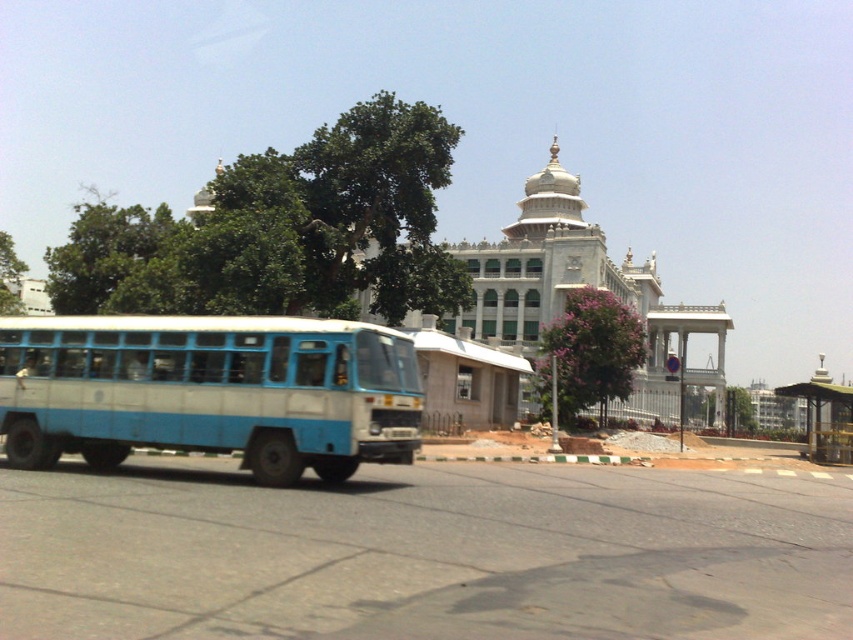
You are a delivery driver who needs to park your vehicle at the designated spot near the ornate building. The blue matte bus at left is currently blocking the path. Can you safely maneuver around it without causing any obstruction?

The blue matte bus at left is located at point (209,392), so yes, you can safely maneuver around it by positioning your vehicle appropriately based on its coordinates.

You are a tourist standing at the metallic green bus stop at lower right, looking towards the white marble palace at center. Which structure appears larger in your view?

The white marble palace at center appears much larger in your view because it is much taller than the metallic green bus stop at lower right.

Please provide the coordinates of the blue matte bus at left in the image. The coordinate system has the origin at the bottom left corner of the image, with x increasing to the right and y increasing upwards.

The coordinates of the blue matte bus at left are at point [209,392].